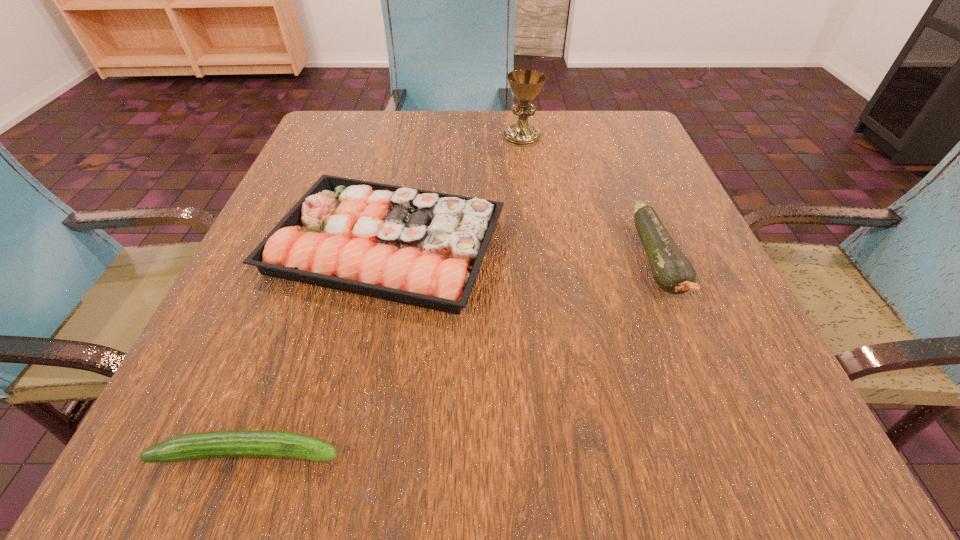
This screenshot has height=540, width=960. I want to click on vacant space that is in between the farthest object and the taller zucchini, so click(x=589, y=199).

The width and height of the screenshot is (960, 540). I want to click on vacant area that lies between the nearer zucchini and the farther zucchini, so click(x=453, y=356).

This screenshot has height=540, width=960. I want to click on unoccupied area between the second shortest object and the second tallest object, so click(521, 253).

Locate an element on the screen. This screenshot has width=960, height=540. vacant space in between the right zucchini and the nearer zucchini is located at coordinates pos(453,356).

Identify which object is the third closest to the third object from left to right. Please provide its 2D coordinates. Your answer should be formatted as a tuple, i.e. [(x, y)], where the tuple contains the x and y coordinates of a point satisfying the conditions above.

[(233, 443)]

This screenshot has height=540, width=960. What are the coordinates of `object that ranks as the second closest to the nearest object` in the screenshot? It's located at (673, 272).

Where is `free spot that satisfies the following two spatial constraints: 1. at the blossom end of the rightmost object; 2. on the front-facing side of the nearer zucchini`? The image size is (960, 540). free spot that satisfies the following two spatial constraints: 1. at the blossom end of the rightmost object; 2. on the front-facing side of the nearer zucchini is located at coordinates [734, 452].